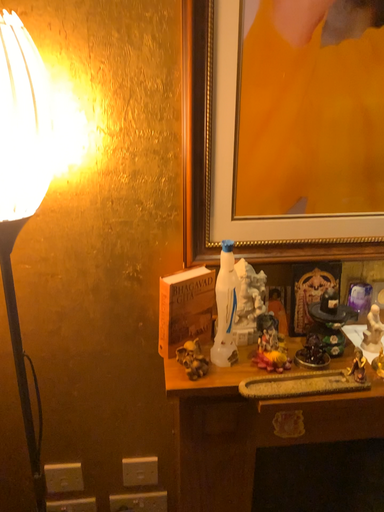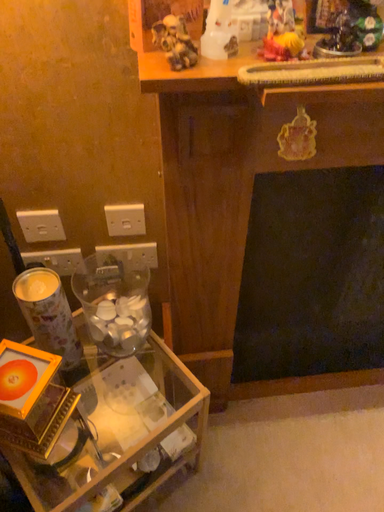
Question: How did the camera likely rotate when shooting the video?

Choices:
 (A) rotated upward
 (B) rotated downward

Answer: (B)